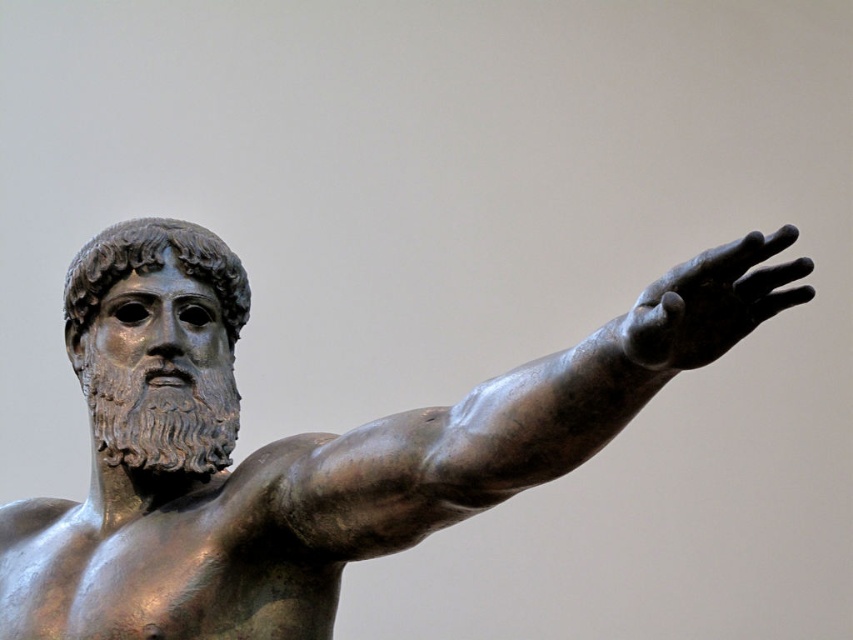
Question: Can you confirm if shiny bronze statue at center is wider than bronze hand at upper right?

Choices:
 (A) no
 (B) yes

Answer: (B)

Question: Is shiny bronze statue at center below bronze hand at upper right?

Choices:
 (A) yes
 (B) no

Answer: (A)

Question: Can you confirm if shiny bronze statue at center is wider than bronze hand at upper right?

Choices:
 (A) no
 (B) yes

Answer: (B)

Question: Which of the following is the farthest from the observer?

Choices:
 (A) bronze hand at upper right
 (B) shiny bronze statue at center

Answer: (B)

Question: Which object appears farthest from the camera in this image?

Choices:
 (A) bronze hand at upper right
 (B) shiny bronze statue at center

Answer: (B)